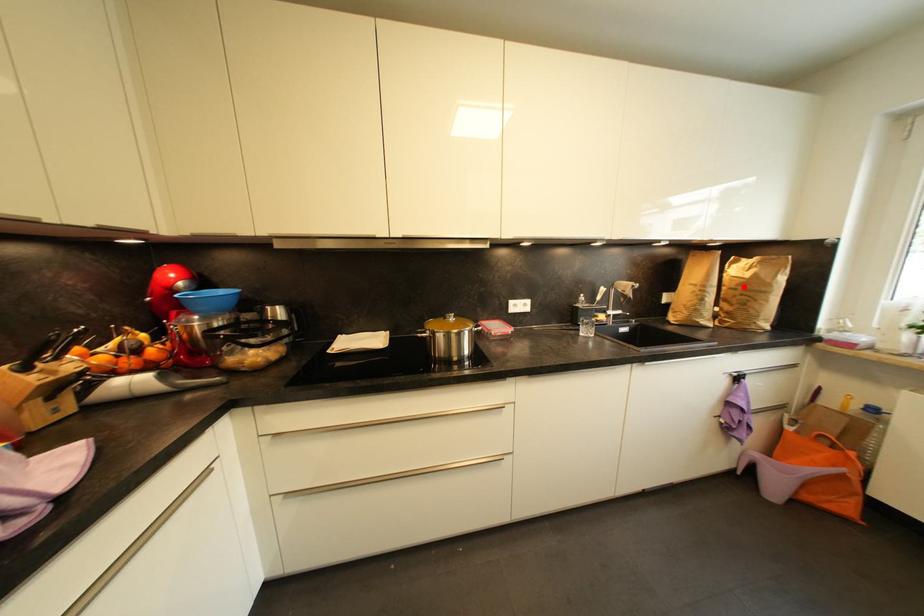
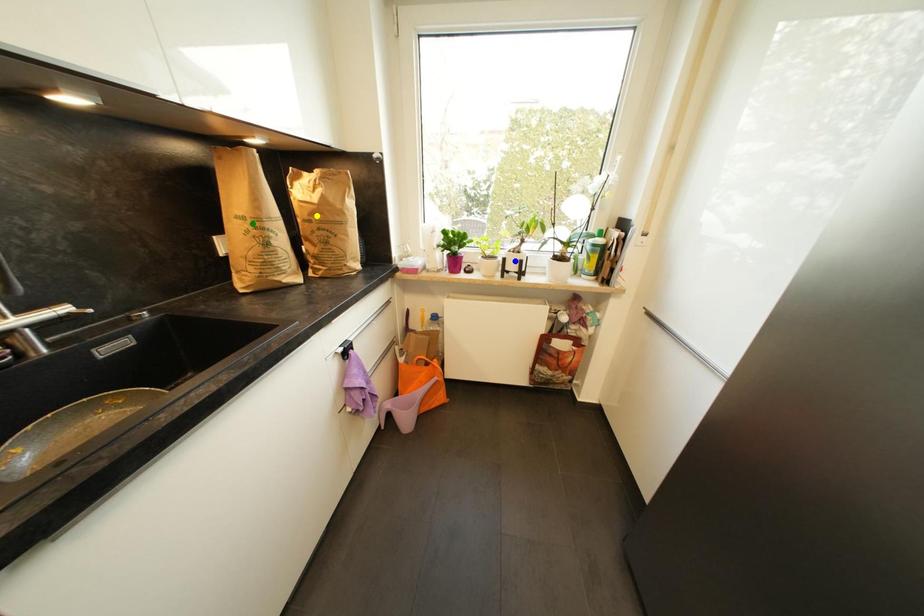
Question: I am providing you with two images of the same scene from different viewpoints. A red point is marked on the first image. You are given multiple points on the second image. Can you choose the point in image 2 that corresponds to the point in image 1?

Choices:
 (A) blue point
 (B) yellow point
 (C) green point

Answer: (B)